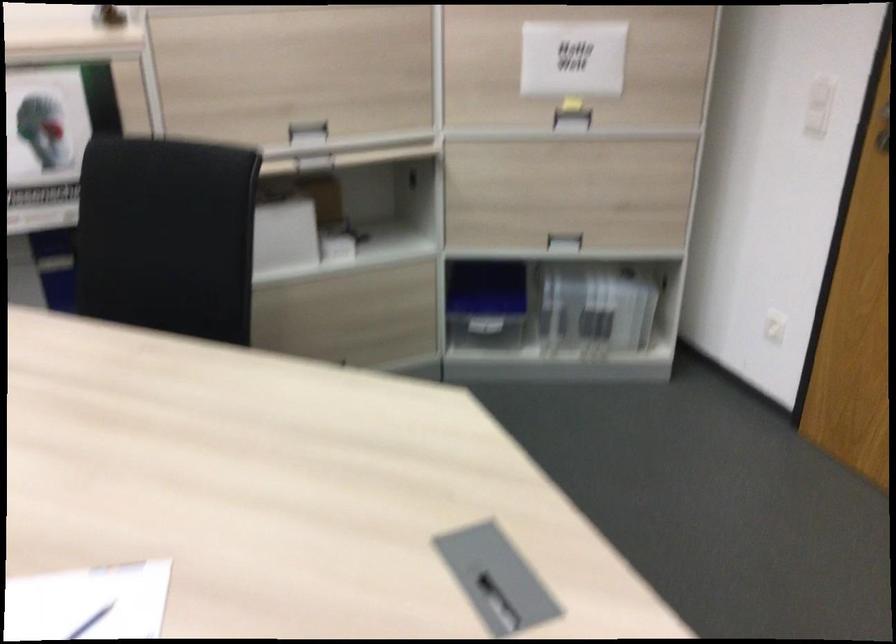
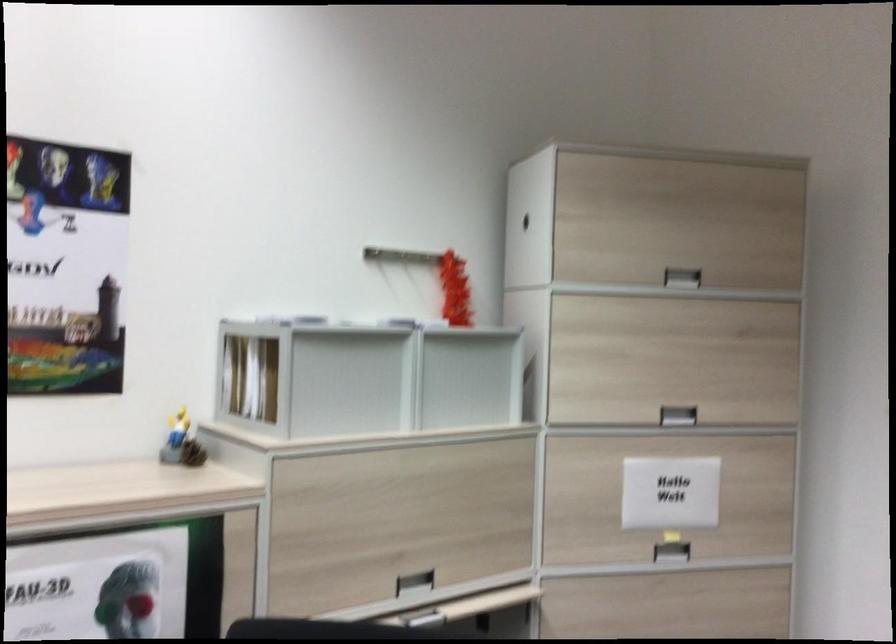
Where in the second image is the point corresponding to (309,136) from the first image?

(415, 583)